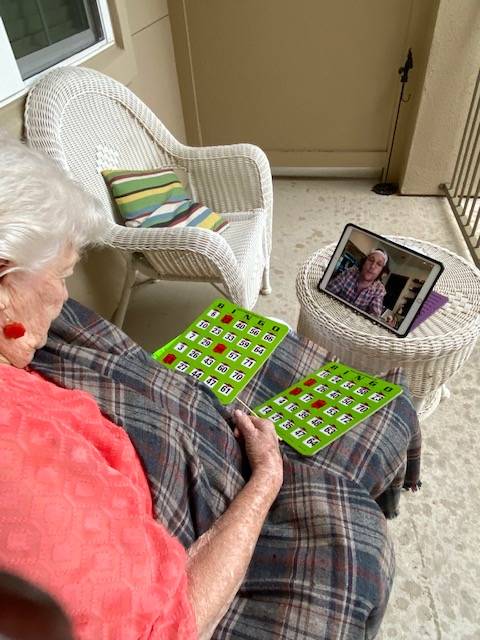
The height and width of the screenshot is (640, 480). What are the coordinates of `ipad` in the screenshot? It's located at click(x=433, y=274).